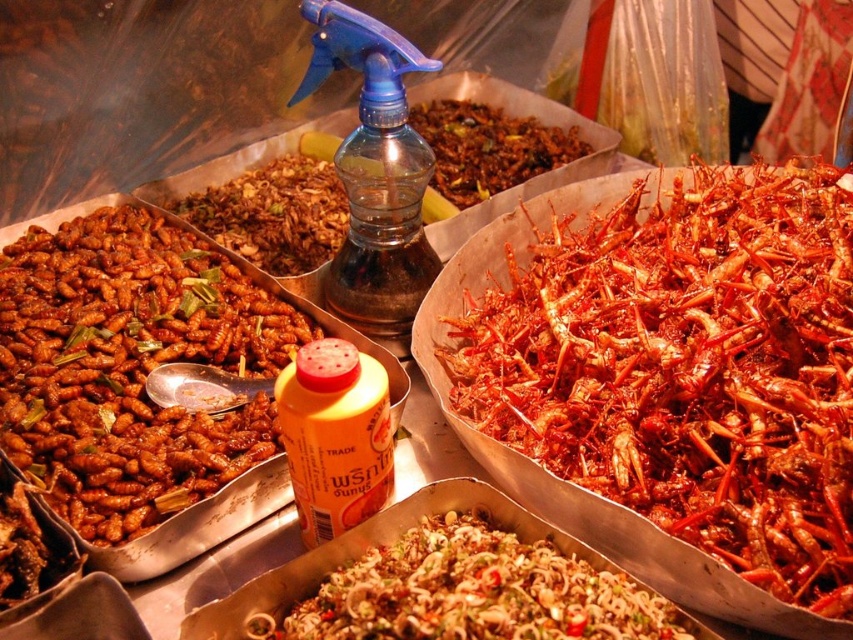
You are a food vendor at a night market. You have a shiny green salad at center and a brown crispy insects at center. A customer asks if the salad can fit on the same plate as the insects. Based on their sizes, what do you tell them?

The shiny green salad at center is wider than the brown crispy insects at center. Since the salad takes up more space, it might not fit comfortably on the same plate unless the plate is large enough to accommodate both.